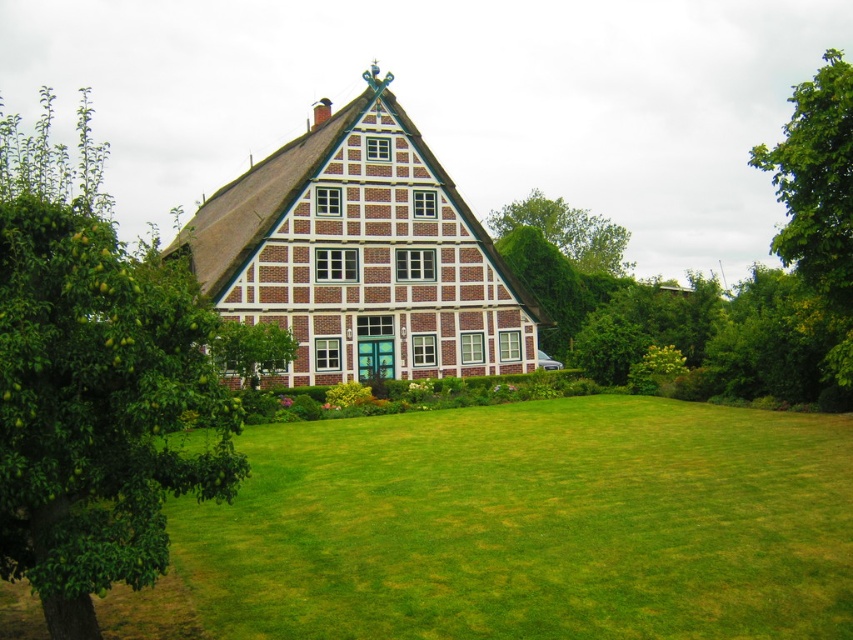
Between green leafy tree at left and brick house at center, which one appears on the left side from the viewer's perspective?

green leafy tree at left

Is point (144, 483) in front of point (398, 214)?

That is True.

Image resolution: width=853 pixels, height=640 pixels. Describe the element at coordinates (93, 384) in the screenshot. I see `green leafy tree at left` at that location.

Find the location of a particular element. green leafy tree at left is located at coordinates (93, 384).

Measure the distance from green leafy tree at upper right to green leafy tree at upper center.

green leafy tree at upper right and green leafy tree at upper center are 35.13 meters apart from each other.

Does green leafy tree at upper right have a smaller size compared to green leafy tree at upper center?

No.

Who is more distant from viewer, (817, 198) or (619, 246)?

Point (619, 246)

Where is `green leafy tree at upper right`? green leafy tree at upper right is located at coordinates (816, 180).

Does green leafy tree at upper center appear on the right side of green leafy tree at center?

Correct, you'll find green leafy tree at upper center to the right of green leafy tree at center.

Does point (569, 257) lie in front of point (286, 353)?

No, it is not.

Is point (598, 225) farther from camera compared to point (225, 324)?

Yes, it is.

Locate an element on the screen. green leafy tree at upper center is located at coordinates (567, 230).